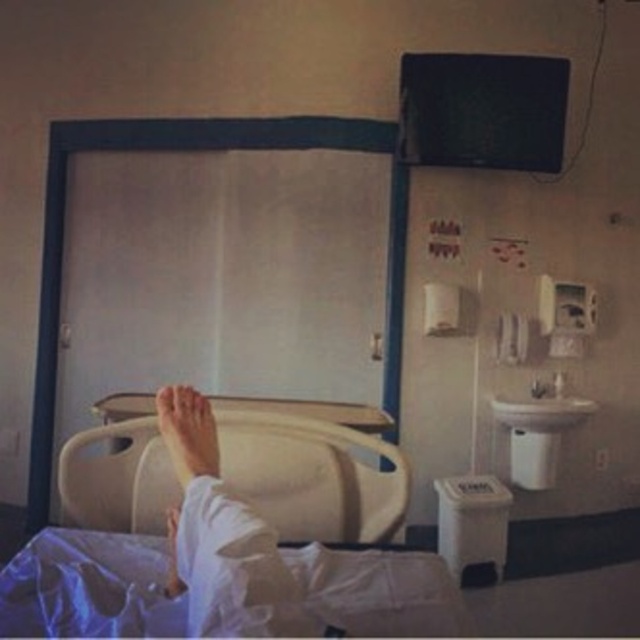
Does white plastic bed at lower center appear under beige plastic hospital bed at lower center?

No, white plastic bed at lower center is not below beige plastic hospital bed at lower center.

Does point (436, 573) come farther from viewer compared to point (266, 477)?

No, (436, 573) is closer to viewer.

Who is more forward, (328, 595) or (282, 497)?

Point (328, 595) is in front.

Locate an element on the screen. white plastic bed at lower center is located at coordinates (220, 570).

Locate an element on the screen. This screenshot has width=640, height=640. beige plastic hospital bed at lower center is located at coordinates (314, 476).

Which is behind, point (138, 486) or point (193, 477)?

Positioned behind is point (138, 486).

Identify the location of beige plastic hospital bed at lower center. The width and height of the screenshot is (640, 640). (314, 476).

Which is below, beige plastic hospital bed at lower center or white fabric foot at lower center?

Positioned lower is beige plastic hospital bed at lower center.

Describe the element at coordinates (314, 476) in the screenshot. I see `beige plastic hospital bed at lower center` at that location.

Locate an element on the screen. beige plastic hospital bed at lower center is located at coordinates (314, 476).